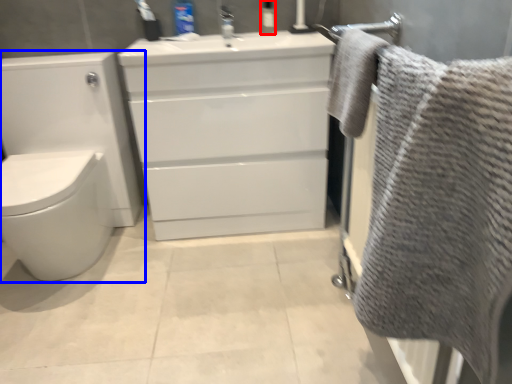
Question: Among these objects, which one is nearest to the camera, toiletry (highlighted by a red box) or toilet (highlighted by a blue box)?

Choices:
 (A) toiletry
 (B) toilet

Answer: (B)